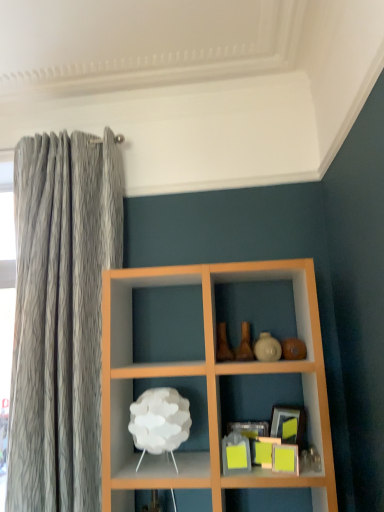
Locate an element on the screen. white matte lamp at center is located at coordinates (159, 422).

Describe the element at coordinates (159, 422) in the screenshot. Image resolution: width=384 pixels, height=512 pixels. I see `white matte lamp at center` at that location.

Locate an element on the screen. Image resolution: width=384 pixels, height=512 pixels. white matte lamp at center is located at coordinates (159, 422).